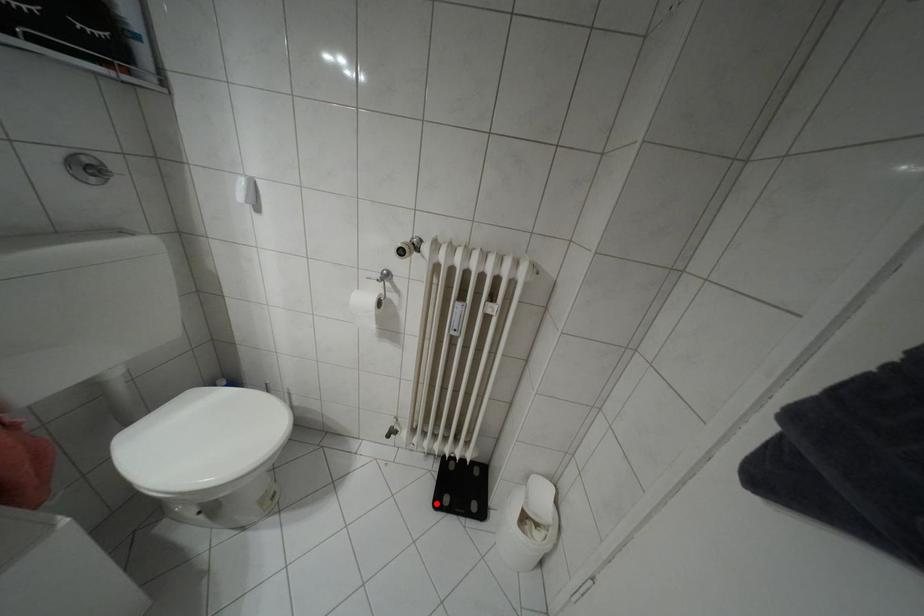
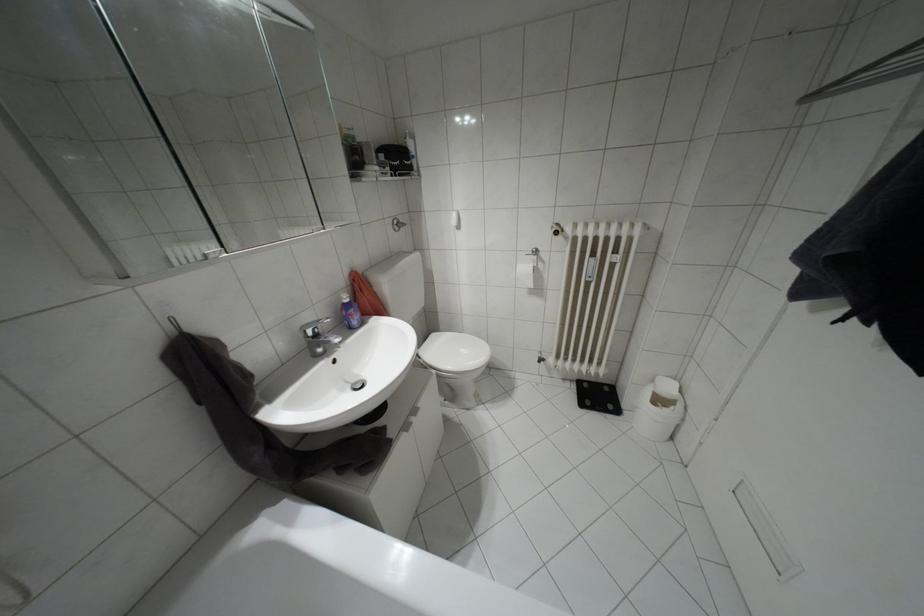
Question: I am providing you with two images of the same scene from different viewpoints. A red point is shown in image1. For the corresponding object point in image2, is it positioned nearer or farther from the camera?

Choices:
 (A) Nearer
 (B) Farther

Answer: (A)